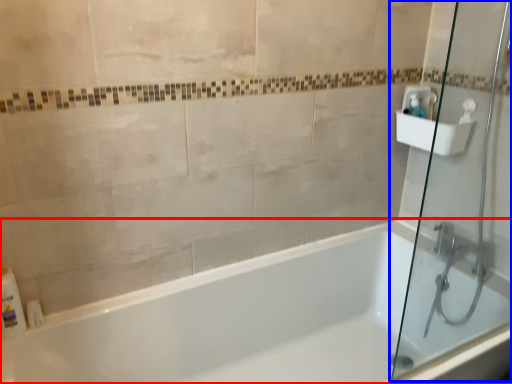
Question: Which of the following is the farthest to the observer, bathtub (highlighted by a red box) or shower door (highlighted by a blue box)?

Choices:
 (A) bathtub
 (B) shower door

Answer: (B)